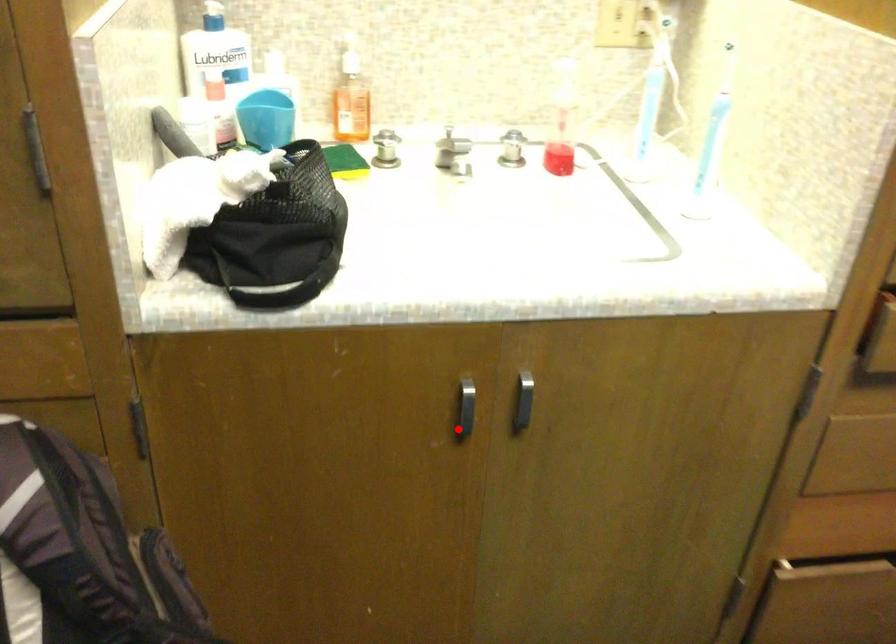
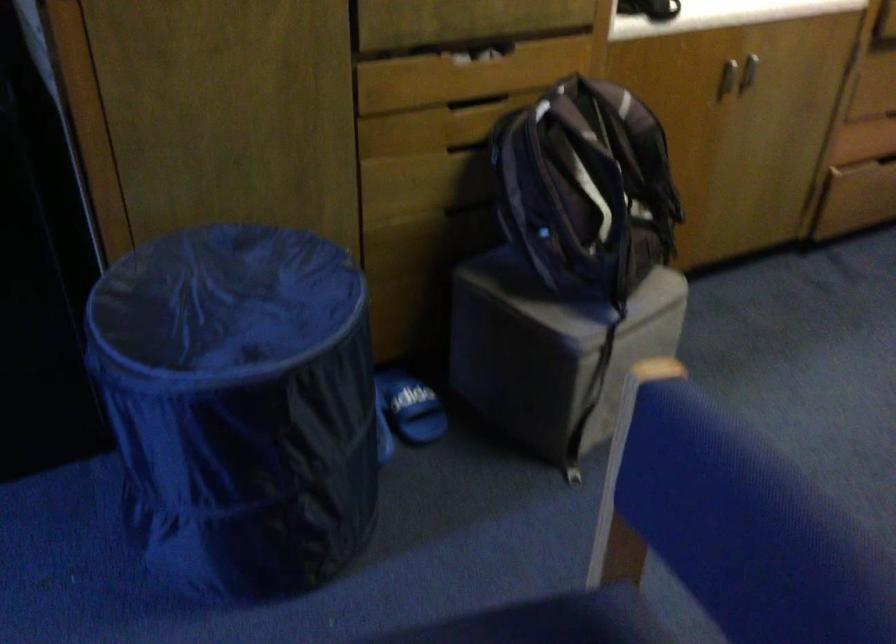
Locate, in the second image, the point that corresponds to the highlighted location in the first image.

(728, 79)